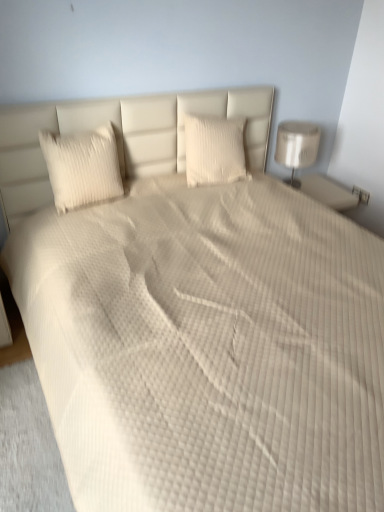
Question: In which direction should I rotate to look at white textured pillow at center, arranged as the first pillow when viewed from the right?

Choices:
 (A) left
 (B) right

Answer: (B)

Question: Is white textured pillow at center, arranged as the first pillow when viewed from the right, positioned before white textured pillow at left, acting as the first pillow starting from the left?

Choices:
 (A) no
 (B) yes

Answer: (A)

Question: From a real-world perspective, does white textured pillow at center, which ranks as the 2th pillow in left-to-right order, stand above white textured pillow at left, acting as the first pillow starting from the left?

Choices:
 (A) no
 (B) yes

Answer: (B)

Question: From a real-world perspective, is white textured pillow at center, which ranks as the 2th pillow in left-to-right order, positioned under white textured pillow at left, acting as the first pillow starting from the left, based on gravity?

Choices:
 (A) no
 (B) yes

Answer: (A)

Question: Is white textured pillow at center, arranged as the first pillow when viewed from the right, taller than white textured pillow at left, acting as the first pillow starting from the left?

Choices:
 (A) no
 (B) yes

Answer: (A)

Question: Considering the relative positions of white textured pillow at center, arranged as the first pillow when viewed from the right, and white textured pillow at left, marked as the 2th pillow in a right-to-left arrangement, in the image provided, is white textured pillow at center, arranged as the first pillow when viewed from the right, to the right of white textured pillow at left, marked as the 2th pillow in a right-to-left arrangement, from the viewer's perspective?

Choices:
 (A) no
 (B) yes

Answer: (B)

Question: Is white textured pillow at center, arranged as the first pillow when viewed from the right, oriented away from white textured pillow at left, acting as the first pillow starting from the left?

Choices:
 (A) yes
 (B) no

Answer: (B)

Question: Is white textured pillow at center, arranged as the first pillow when viewed from the right, closer to camera compared to white glossy lamp at right?

Choices:
 (A) no
 (B) yes

Answer: (B)

Question: Does white textured pillow at center, which ranks as the 2th pillow in left-to-right order, have a lesser width compared to white glossy lamp at right?

Choices:
 (A) yes
 (B) no

Answer: (A)

Question: Considering the relative sizes of white textured pillow at center, which ranks as the 2th pillow in left-to-right order, and white glossy lamp at right in the image provided, is white textured pillow at center, which ranks as the 2th pillow in left-to-right order, bigger than white glossy lamp at right?

Choices:
 (A) yes
 (B) no

Answer: (B)

Question: Considering the relative sizes of white textured pillow at center, which ranks as the 2th pillow in left-to-right order, and white glossy lamp at right in the image provided, is white textured pillow at center, which ranks as the 2th pillow in left-to-right order, shorter than white glossy lamp at right?

Choices:
 (A) no
 (B) yes

Answer: (B)

Question: Does white textured pillow at center, arranged as the first pillow when viewed from the right, have a greater height compared to white glossy lamp at right?

Choices:
 (A) yes
 (B) no

Answer: (B)

Question: Does white textured pillow at center, arranged as the first pillow when viewed from the right, have a greater width compared to white glossy lamp at right?

Choices:
 (A) no
 (B) yes

Answer: (A)

Question: Can you confirm if white textured pillow at left, acting as the first pillow starting from the left, is smaller than white glossy lamp at right?

Choices:
 (A) no
 (B) yes

Answer: (B)